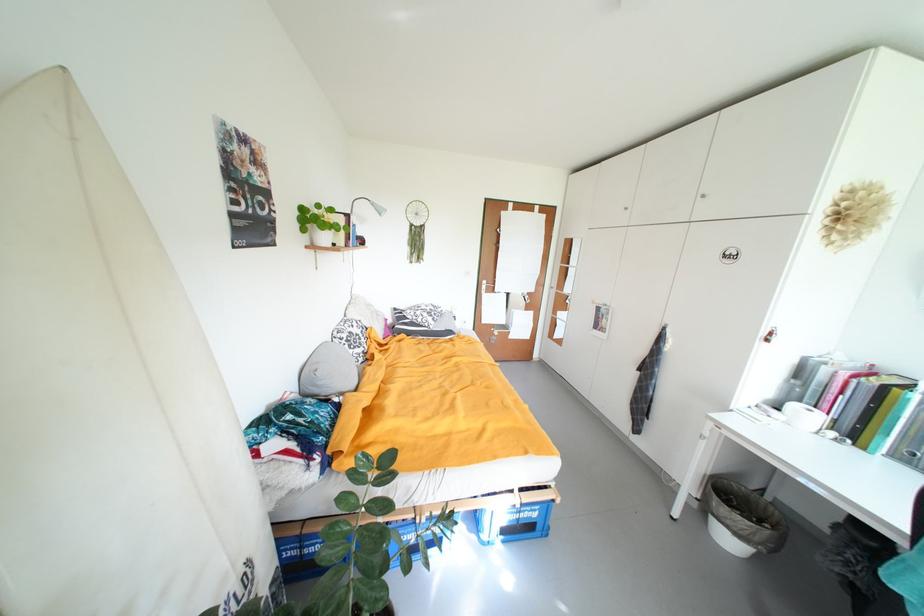
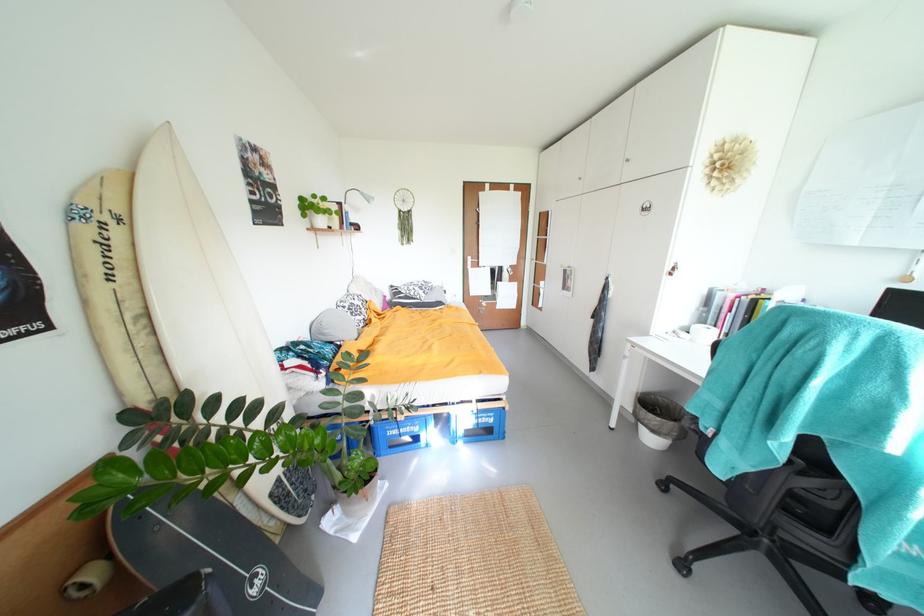
Locate, in the second image, the point that corresponds to pixel 381 206 in the first image.

(370, 196)